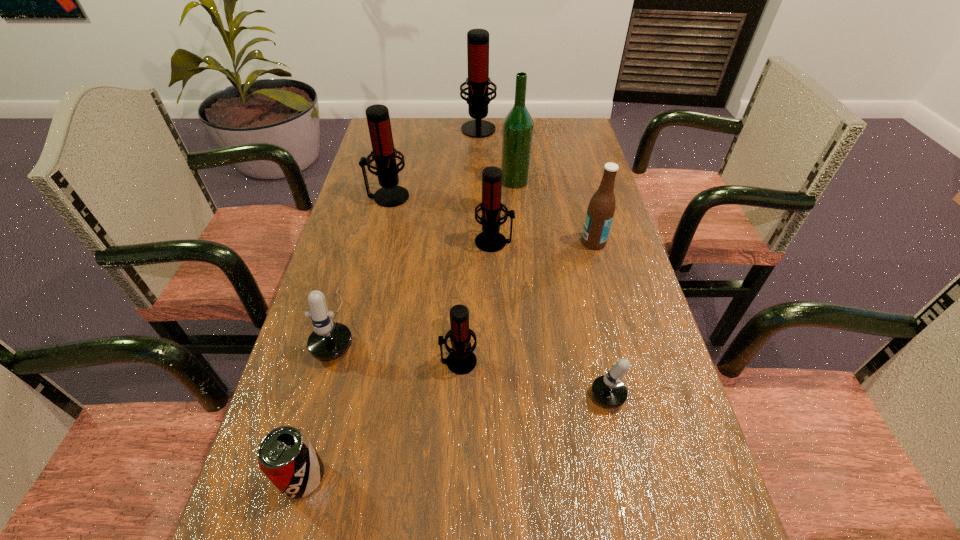
You are a GUI agent. You are given a task and a screenshot of the screen. Output one action in this format:
    pyautogui.click(x=<x>, y=<y>)
    Task: Click on the farthest object
    
    Given the screenshot: What is the action you would take?
    pyautogui.click(x=478, y=81)

At what (x,y) coordinates should I click in order to perform the action: click on the tallest microphone. Please return your answer as a coordinate pair (x, y). Image resolution: width=960 pixels, height=540 pixels. Looking at the image, I should click on (478, 81).

Find the location of a particular element. green alcohol is located at coordinates (518, 126).

This screenshot has width=960, height=540. Identify the location of the fifth nearest microphone. (384, 154).

Locate an element on the screen. This screenshot has width=960, height=540. the second biggest red microphone is located at coordinates (384, 154).

Identify the location of beer bottle. The height and width of the screenshot is (540, 960). (601, 209).

What are the coordinates of `the fourth shortest microphone` in the screenshot? It's located at pyautogui.click(x=490, y=240).

Find the location of a particular element. This screenshot has width=960, height=540. the third farthest microphone is located at coordinates (490, 240).

At what (x,y) coordinates should I click in order to perform the action: click on the bigger white microphone. Please return your answer as a coordinate pair (x, y). This screenshot has height=540, width=960. Looking at the image, I should click on (329, 340).

Where is `the farther white microphone`? This screenshot has width=960, height=540. the farther white microphone is located at coordinates (329, 340).